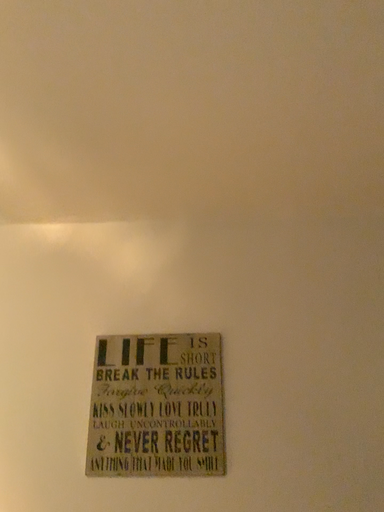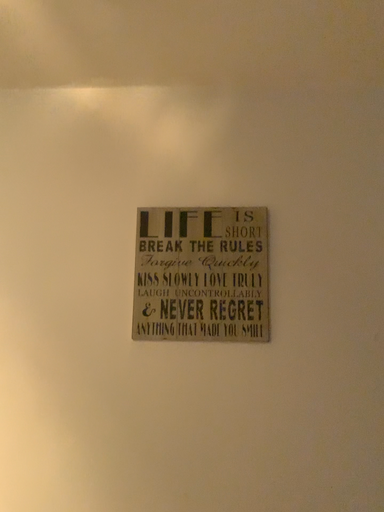
Question: Which way did the camera rotate in the video?

Choices:
 (A) rotated upward
 (B) rotated downward

Answer: (B)